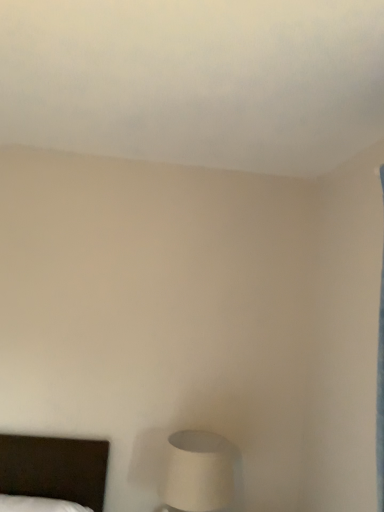
This screenshot has width=384, height=512. What do you see at coordinates (201, 473) in the screenshot?
I see `white fabric lampshade at lower right` at bounding box center [201, 473].

What are the coordinates of `white fabric lampshade at lower right` in the screenshot? It's located at (201, 473).

What is the approximate height of white fabric lampshade at lower right?

It is 13.71 inches.

Locate an element on the screen. This screenshot has height=512, width=384. white fabric lampshade at lower right is located at coordinates (201, 473).